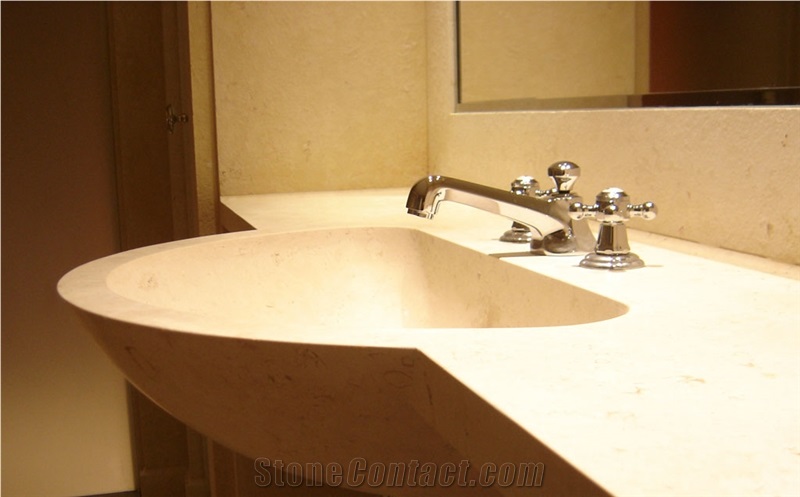
Identify the location of doors. (730, 41), (74, 77), (197, 164).